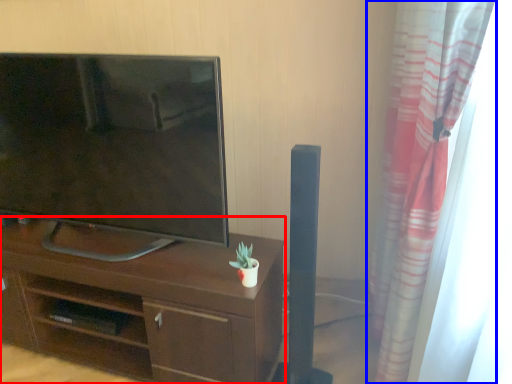
Question: Which of the following is the closest to the observer, desk (highlighted by a red box) or curtain (highlighted by a blue box)?

Choices:
 (A) desk
 (B) curtain

Answer: (B)